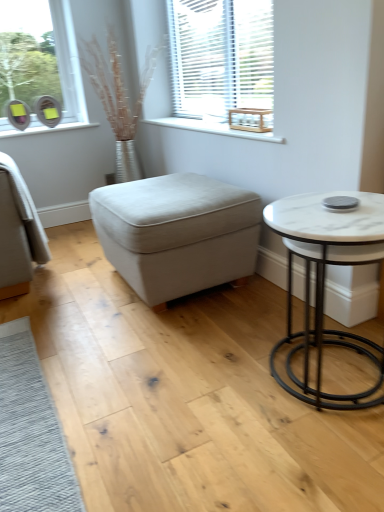
Find the location of a particular element. This screenshot has width=384, height=512. vacant area on top of white marble table at right (from a real-world perspective) is located at coordinates (324, 214).